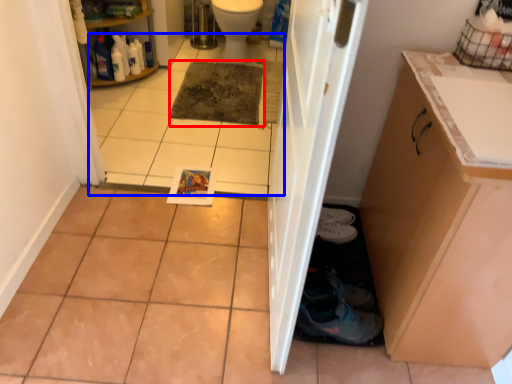
Question: Which of the following is the farthest to the observer, mat (highlighted by a red box) or tile (highlighted by a blue box)?

Choices:
 (A) mat
 (B) tile

Answer: (A)